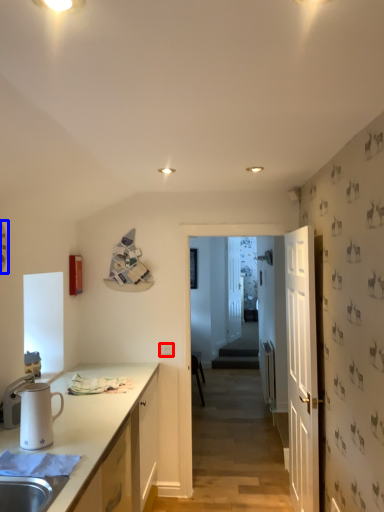
Question: Which object appears farthest to the camera in this image, electric outlet (highlighted by a red box) or clock (highlighted by a blue box)?

Choices:
 (A) electric outlet
 (B) clock

Answer: (A)